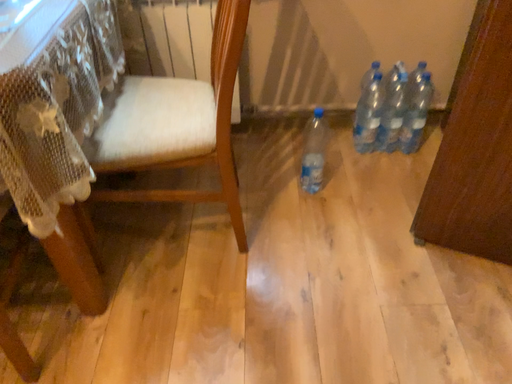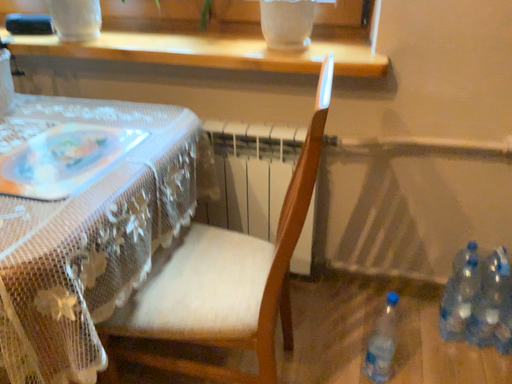
Question: How did the camera likely rotate when shooting the video?

Choices:
 (A) rotated left
 (B) rotated right

Answer: (A)